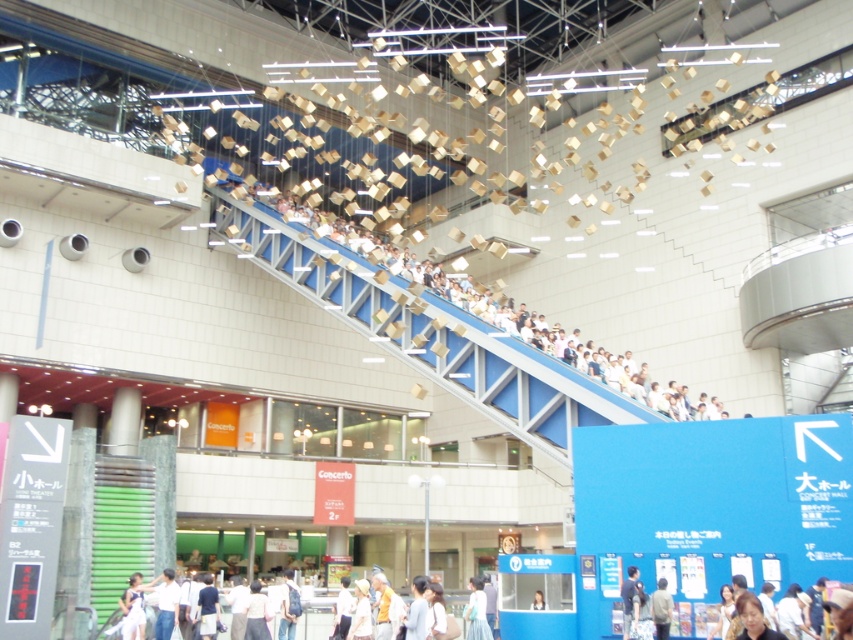
Is point (473, 584) closer to viewer compared to point (622, 580)?

No, (473, 584) is further to viewer.

Does light blue fabric at lower center have a greater width compared to light blue shirt at upper center?

Correct, the width of light blue fabric at lower center exceeds that of light blue shirt at upper center.

Which is behind, point (477, 632) or point (631, 611)?

Positioned behind is point (477, 632).

This screenshot has width=853, height=640. What are the coordinates of `light blue fabric at lower center` in the screenshot? It's located at (476, 611).

Is light blue shirt at upper center bigger than light brown hair at upper center?

Correct, light blue shirt at upper center is larger in size than light brown hair at upper center.

Can you confirm if light blue shirt at upper center is thinner than light brown hair at upper center?

In fact, light blue shirt at upper center might be wider than light brown hair at upper center.

Image resolution: width=853 pixels, height=640 pixels. I want to click on light blue shirt at upper center, so click(630, 598).

Is matte black hair at lower right positioned before light blue shirt at lower center?

Yes, it is.

Is matte black hair at lower right taller than light blue shirt at lower center?

No.

Which is behind, point (769, 637) or point (412, 586)?

Point (412, 586)

I want to click on matte black hair at lower right, so click(753, 618).